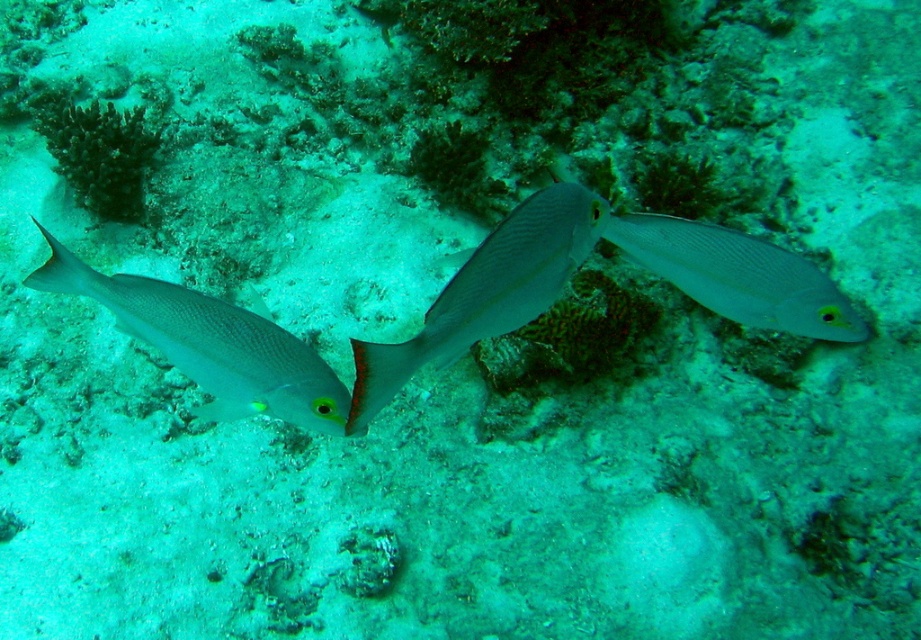
You are a marine biologist observing the underwater scene. You notice two fish, the smooth silver fish at center and the satin silver fish at center. Which one is positioned lower in the water?

The smooth silver fish at center is located below the satin silver fish at center, so it is positioned lower in the water.

You are a marine biologist observing the underwater scene. You notice two fish, the silvery smooth fish at left and the smooth silver fish at center. Which fish is positioned closer to the coral reef in the background?

The smooth silver fish at center is behind the silvery smooth fish at left, meaning it is farther from the observer and closer to the coral reef in the background.

You are a marine biologist observing underwater life. You notice two fish, the silvery smooth fish at left and the satin silver fish at center. Based on their positions, which fish is closer to the left side of your field of view?

The silvery smooth fish at left is closer to the left side of your field of view because it is positioned to the left of the satin silver fish at center.